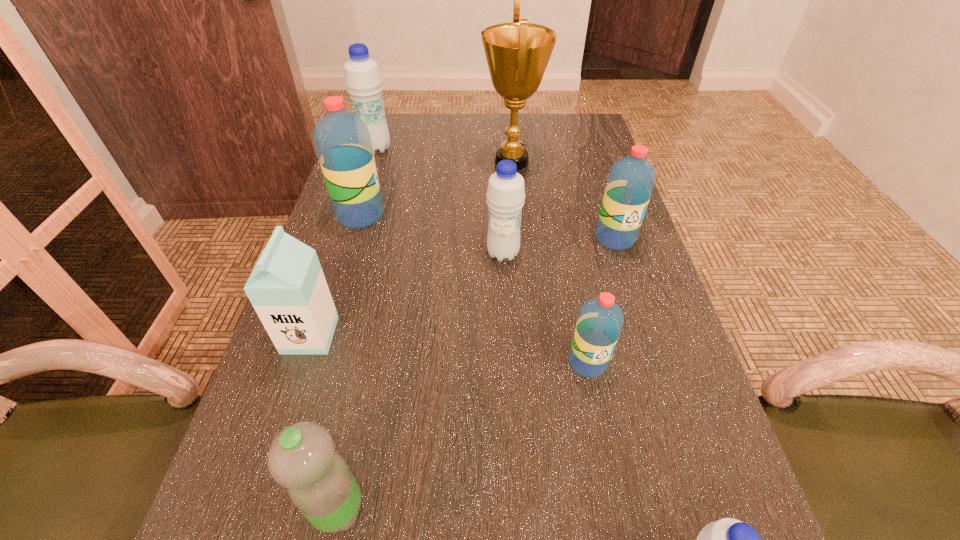
Identify which water bottle is the fifth nearest to the nearest water bottle. Please provide its 2D coordinates. Your answer should be formatted as a tuple, i.e. [(x, y)], where the tuple contains the x and y coordinates of a point satisfying the conditions above.

[(342, 140)]

Where is `the third closest water bottle to the leftmost red water bottle`? This screenshot has width=960, height=540. the third closest water bottle to the leftmost red water bottle is located at coordinates (631, 179).

Locate an element on the screen. This screenshot has width=960, height=540. blue water bottle that is the second nearest to the nearest object is located at coordinates (363, 80).

You are a GUI agent. You are given a task and a screenshot of the screen. Output one action in this format:
    pyautogui.click(x=<x>, y=<y>)
    Task: Click on the blue water bottle that is the second closest to the nearest object
    
    Given the screenshot: What is the action you would take?
    pyautogui.click(x=363, y=80)

What are the coordinates of `red water bottle that can be found as the second closest to the eighth farthest object` in the screenshot? It's located at (342, 140).

What are the coordinates of `the second closest red water bottle to the second red water bottle from left to right` in the screenshot? It's located at (342, 140).

In order to click on free spot that satisfies the following two spatial constraints: 1. on the front label of the biggest red water bottle; 2. on the back side of the second nearest object in this screenshot , I will do `click(272, 509)`.

In order to click on free space that satisfies the following two spatial constraints: 1. on the front label of the sixth farthest water bottle; 2. on the right side of the biggest red water bottle in this screenshot , I will do `click(272, 509)`.